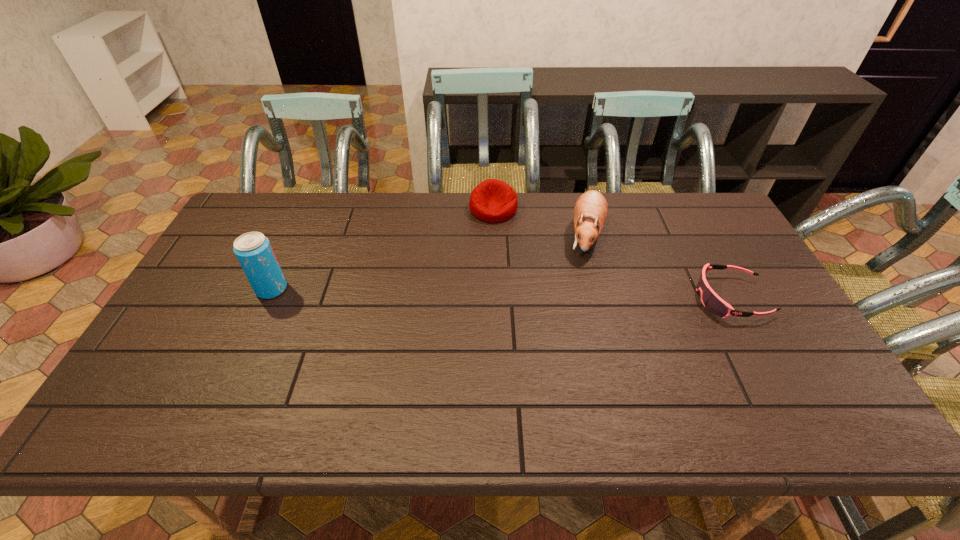
Find the location of a particular element. The image size is (960, 540). free space between the soda can and the beanbag is located at coordinates (382, 249).

I want to click on empty location between the second object from right to left and the rightmost object, so click(x=659, y=267).

The height and width of the screenshot is (540, 960). I want to click on free space that is in between the beanbag and the third object from left to right, so click(540, 222).

What are the coordinates of `unoccupied area between the shortest object and the beanbag` in the screenshot? It's located at (612, 253).

Identify the location of vacant area that lies between the shortest object and the second tallest object. The height and width of the screenshot is (540, 960). (659, 267).

Identify the location of unoccupied area between the goggles and the soda can. The width and height of the screenshot is (960, 540). (501, 294).

The image size is (960, 540). Find the location of `free space between the hamster and the shortest object`. free space between the hamster and the shortest object is located at coordinates (659, 267).

In order to click on object that ranks as the second closest to the beanbag in this screenshot , I will do `click(711, 301)`.

I want to click on object identified as the closest to the tallest object, so click(x=493, y=201).

What are the coordinates of `free space that satisfies the following two spatial constraints: 1. on the front side of the shortest object; 2. on the front-facing side of the soda can` in the screenshot? It's located at (268, 298).